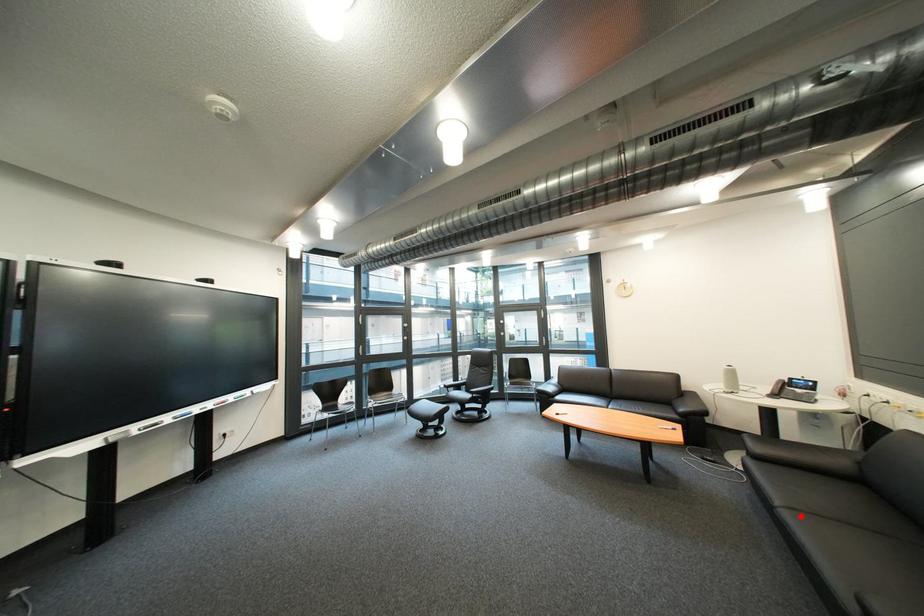
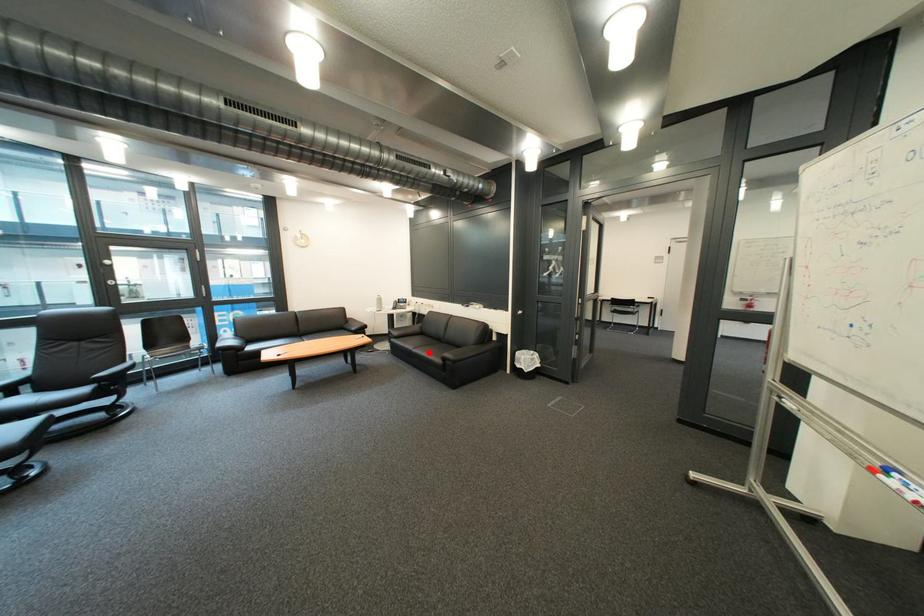
I am providing you with two images of the same scene from different viewpoints. A red point is marked on the first image and another point is marked on the second image. Is the red point in image1 aligned with the point shown in image2?

Yes